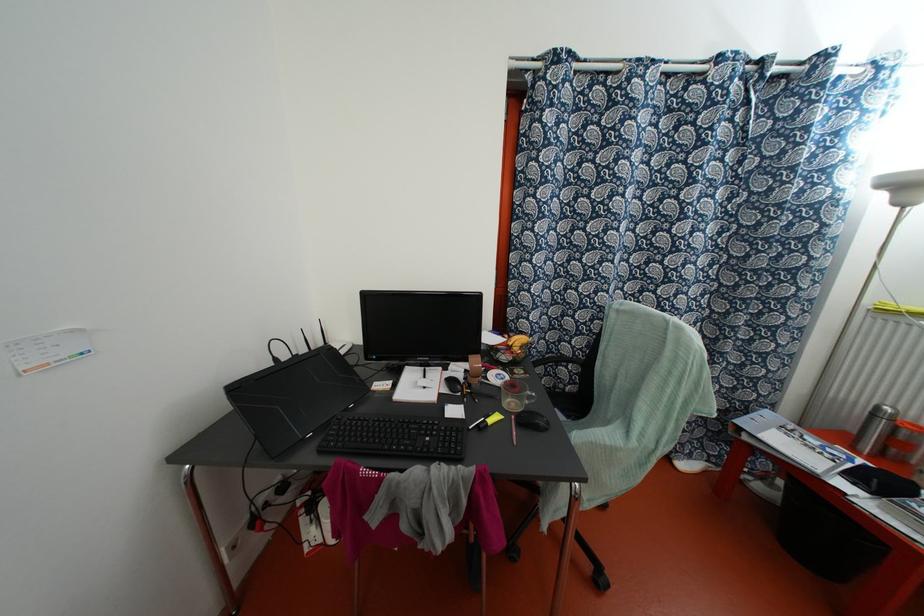
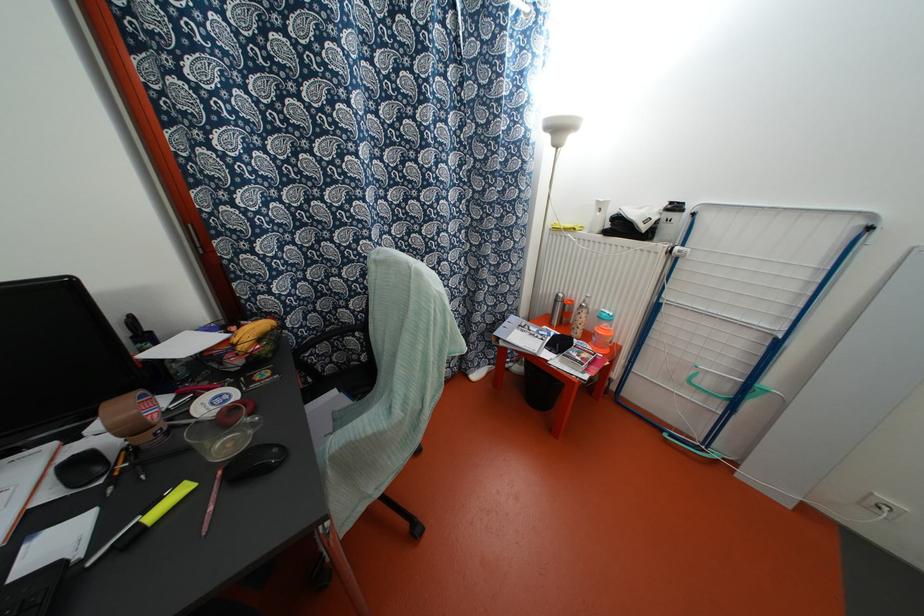
Question: The camera is either moving clockwise (left) or counter-clockwise (right) around the object. The first image is from the beginning of the video and the second image is from the end. Is the camera moving left or right when shooting the video?

Choices:
 (A) Left
 (B) Right

Answer: (A)